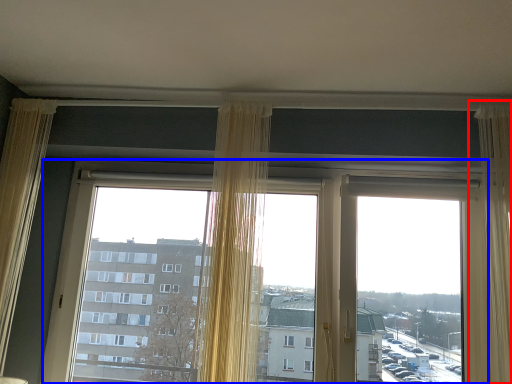
Question: Which of the following is the farthest to the observer, curtain (highlighted by a red box) or window (highlighted by a blue box)?

Choices:
 (A) curtain
 (B) window

Answer: (B)